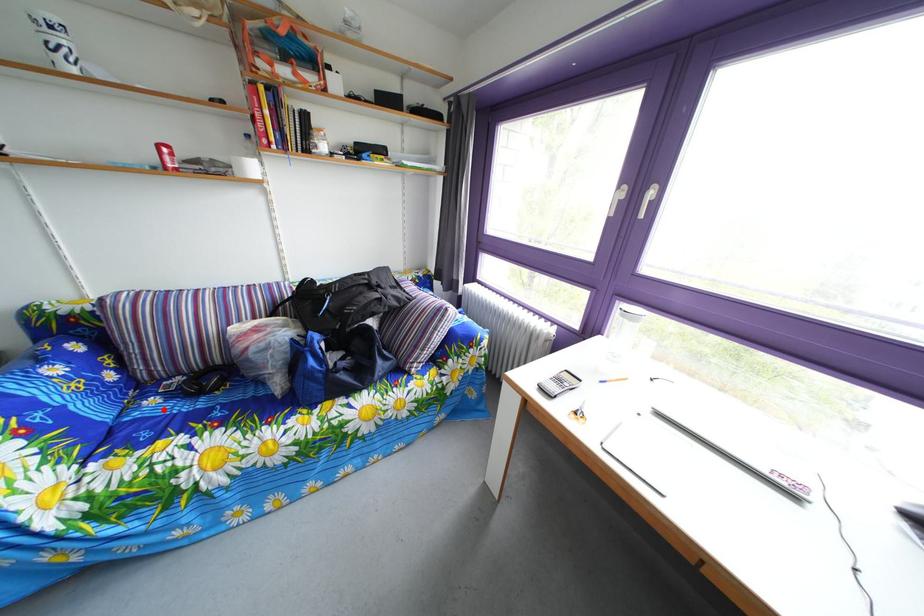
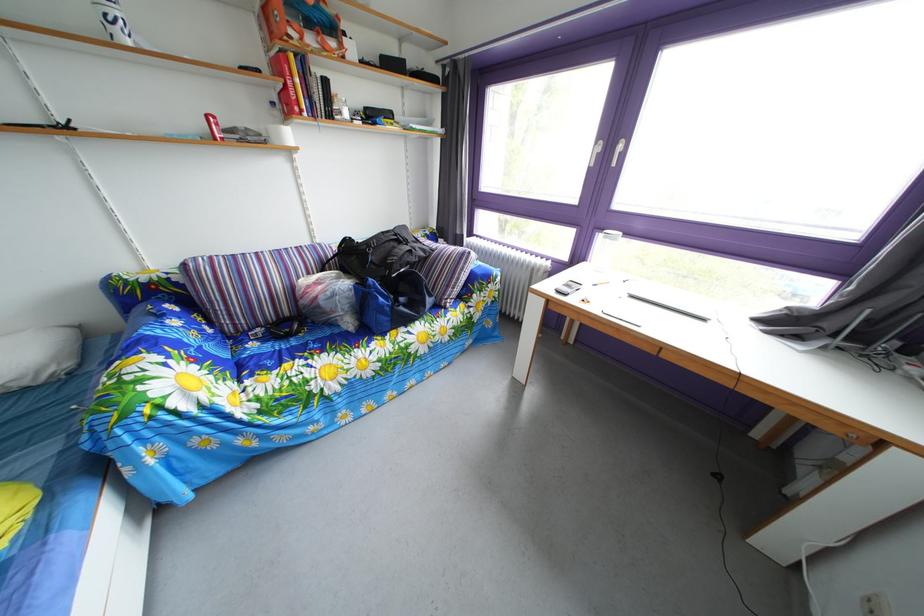
Locate, in the second image, the point that corresponds to the highlighted location in the first image.

(262, 353)